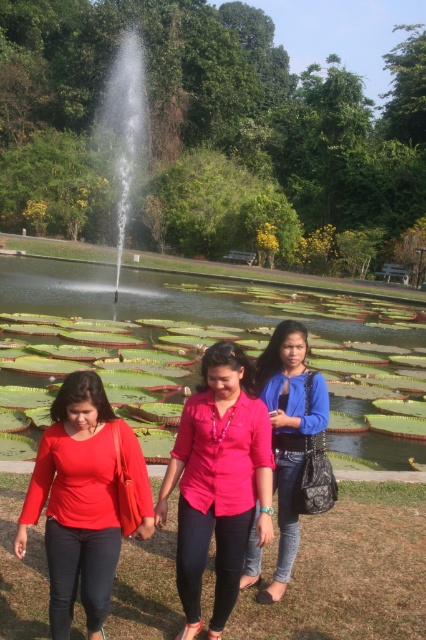
Question: Which object is positioned farthest from the matte red blouse at lower left?

Choices:
 (A) green leafy pond at center
 (B) matte pink blouse at center
 (C) clear glass fountain at center
 (D) blue denim jacket at center

Answer: (C)

Question: Is matte pink blouse at center closer to camera compared to blue denim jacket at center?

Choices:
 (A) no
 (B) yes

Answer: (B)

Question: Considering the real-world distances, which object is farthest from the matte pink blouse at center?

Choices:
 (A) clear glass fountain at center
 (B) blue denim jacket at center

Answer: (A)

Question: In this image, where is matte red blouse at lower left located relative to matte pink blouse at center?

Choices:
 (A) left
 (B) right

Answer: (A)

Question: Is matte red blouse at lower left smaller than blue denim jacket at center?

Choices:
 (A) yes
 (B) no

Answer: (A)

Question: Which object is farther from the camera taking this photo?

Choices:
 (A) blue denim jacket at center
 (B) matte pink blouse at center

Answer: (A)